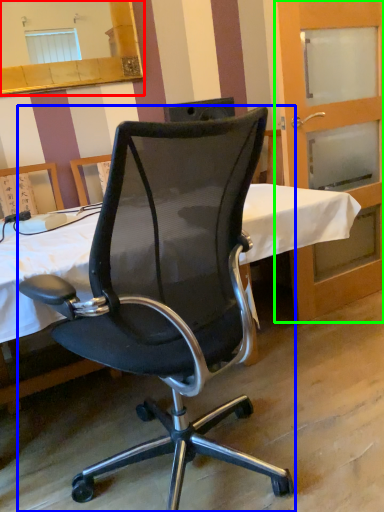
Question: Which is nearer to the mirror (highlighted by a red box)? chair (highlighted by a blue box) or screen door (highlighted by a green box).

Choices:
 (A) chair
 (B) screen door

Answer: (B)